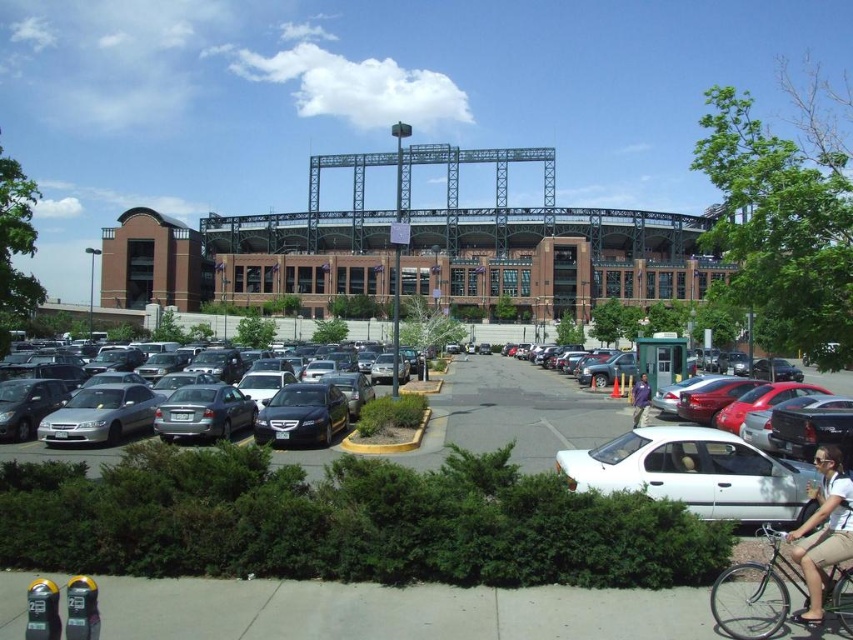
Question: Can you confirm if silver metallic sedan at left is wider than tan fabric shorts at lower right?

Choices:
 (A) yes
 (B) no

Answer: (A)

Question: Which point is closer to the camera?

Choices:
 (A) silver metallic sedan at left
 (B) purple cotton shirt at lower right
 (C) white matte sedan at lower right
 (D) silver metallic car at center

Answer: (C)

Question: Which point is closer to the camera?

Choices:
 (A) (816, 554)
 (B) (115, 432)
 (C) (759, 500)
 (D) (643, 403)

Answer: (A)

Question: Can you confirm if silver metallic bicycle at lower right is positioned to the right of purple cotton shirt at lower right?

Choices:
 (A) yes
 (B) no

Answer: (B)

Question: Among these points, which one is nearest to the camera?

Choices:
 (A) (294, 444)
 (B) (791, 508)

Answer: (B)

Question: Is silver metallic sedan at left bigger than tan fabric shorts at lower right?

Choices:
 (A) no
 (B) yes

Answer: (B)